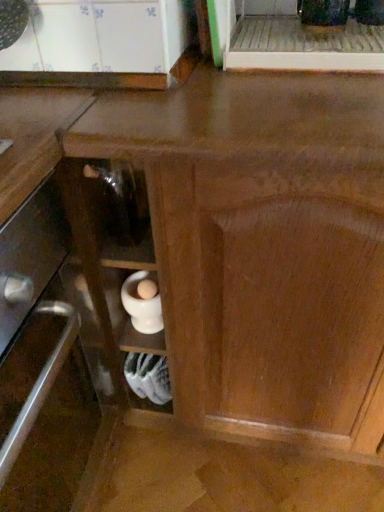
Question: Looking at the image, does white matte mortar at lower center seem bigger or smaller compared to white glossy mortar at lower center?

Choices:
 (A) small
 (B) big

Answer: (B)

Question: From the image's perspective, is white matte mortar at lower center located above or below white glossy mortar at lower center?

Choices:
 (A) above
 (B) below

Answer: (B)

Question: Relative to white glossy mortar at lower center, is white matte mortar at lower center in front or behind?

Choices:
 (A) behind
 (B) front

Answer: (A)

Question: In the image, is white glossy mortar at lower center on the left side or the right side of white matte mortar at lower center?

Choices:
 (A) left
 (B) right

Answer: (B)

Question: Is white glossy mortar at lower center wider or thinner than white matte mortar at lower center?

Choices:
 (A) wide
 (B) thin

Answer: (B)

Question: Is white glossy mortar at lower center in front of or behind white matte mortar at lower center in the image?

Choices:
 (A) front
 (B) behind

Answer: (A)

Question: From a real-world perspective, relative to white matte mortar at lower center, is white glossy mortar at lower center vertically above or below?

Choices:
 (A) below
 (B) above

Answer: (B)